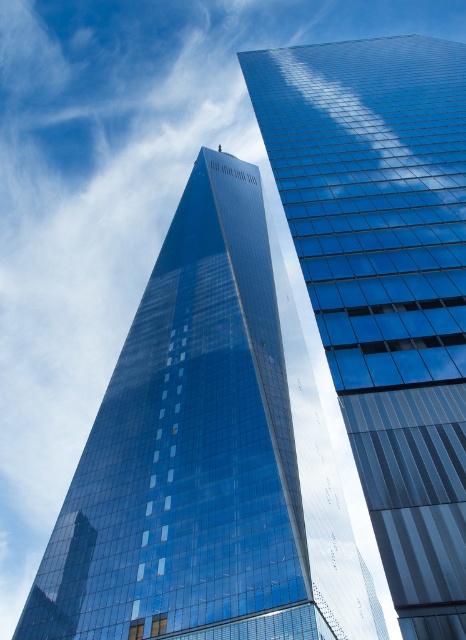
Where is `glossy glass tower at center`? glossy glass tower at center is located at coordinates (206, 458).

Does glossy glass tower at center appear over glossy glass skyscraper at center?

No.

Between point (185, 424) and point (399, 186), which one is positioned behind?

Positioned behind is point (185, 424).

This screenshot has height=640, width=466. I want to click on glossy glass tower at center, so click(x=206, y=458).